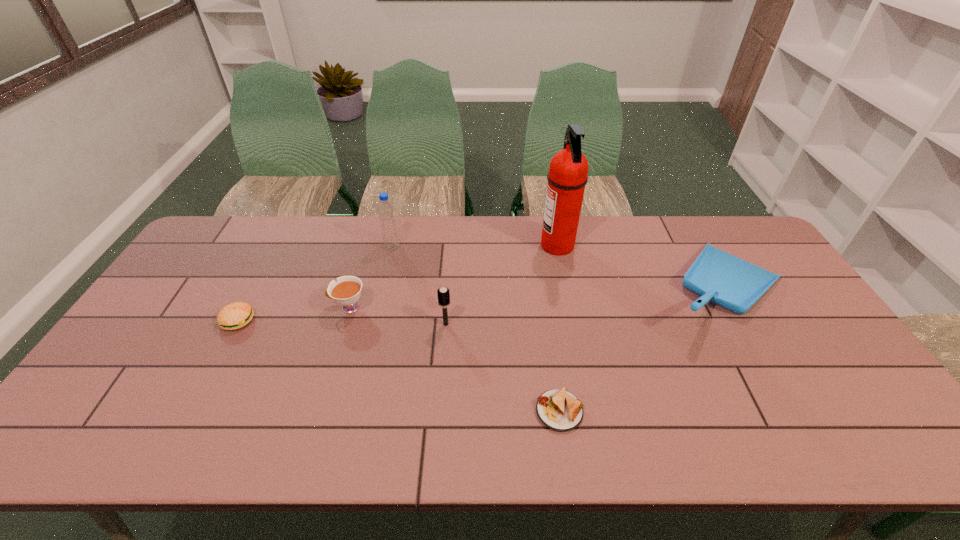
This screenshot has height=540, width=960. What are the coordinates of `fire extinguisher` in the screenshot? It's located at (567, 177).

This screenshot has height=540, width=960. I want to click on water bottle, so click(x=386, y=212).

Locate an element on the screen. the sixth shortest object is located at coordinates click(x=386, y=212).

Locate an element on the screen. Image resolution: width=960 pixels, height=540 pixels. the rightmost object is located at coordinates (717, 276).

This screenshot has height=540, width=960. What are the coordinates of `the fourth object from left to right` in the screenshot? It's located at (443, 294).

Locate an element on the screen. The image size is (960, 540). teacup is located at coordinates (346, 291).

Where is `the third shortest object`? the third shortest object is located at coordinates (346, 291).

Where is `patty`? This screenshot has height=540, width=960. patty is located at coordinates (233, 316).

Where is `the leftmost object`? This screenshot has height=540, width=960. the leftmost object is located at coordinates (233, 316).

I want to click on sandwich, so click(x=558, y=409).